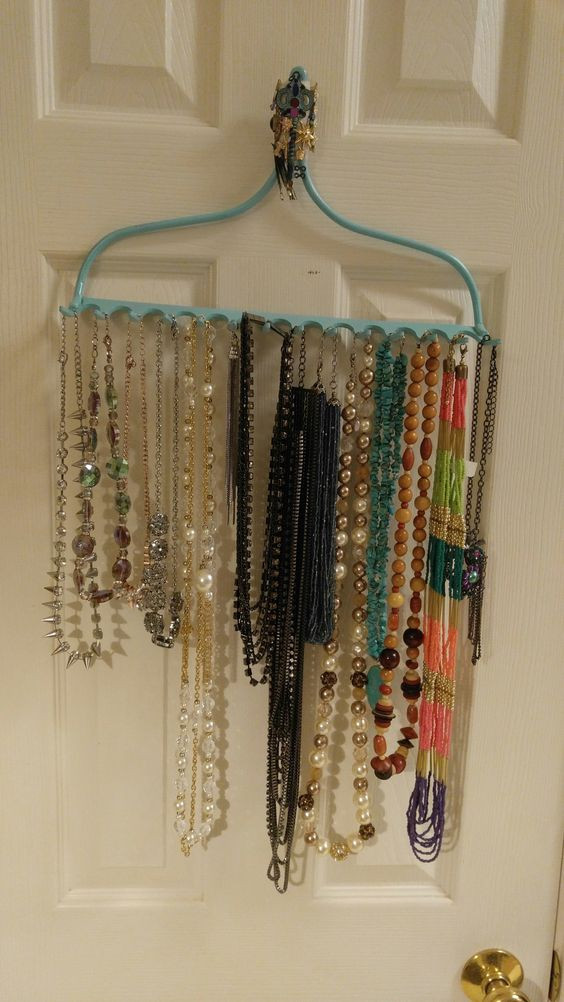
Locate an element on the screen. The height and width of the screenshot is (1002, 564). brass door knob is located at coordinates (504, 958).